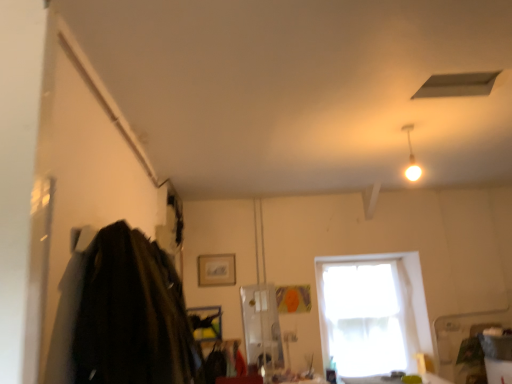
Question: Is white sheer curtain at center further to the viewer compared to dark wool coat at left?

Choices:
 (A) yes
 (B) no

Answer: (A)

Question: From the image's perspective, does white sheer curtain at center appear lower than dark wool coat at left?

Choices:
 (A) no
 (B) yes

Answer: (B)

Question: From the image's perspective, is white sheer curtain at center on dark wool coat at left?

Choices:
 (A) yes
 (B) no

Answer: (B)

Question: Is dark wool coat at left a part of white sheer curtain at center?

Choices:
 (A) yes
 (B) no

Answer: (B)

Question: Considering the relative positions of white sheer curtain at center and dark wool coat at left in the image provided, is white sheer curtain at center in front of dark wool coat at left?

Choices:
 (A) yes
 (B) no

Answer: (B)

Question: Is white sheer curtain at center in contact with dark wool coat at left?

Choices:
 (A) yes
 (B) no

Answer: (B)

Question: Does dark wool coat at left have a greater width compared to white sheer curtain at center?

Choices:
 (A) no
 (B) yes

Answer: (B)

Question: Is there a large distance between dark wool coat at left and white sheer curtain at center?

Choices:
 (A) no
 (B) yes

Answer: (B)

Question: Considering the relative sizes of dark wool coat at left and white sheer curtain at center in the image provided, is dark wool coat at left shorter than white sheer curtain at center?

Choices:
 (A) no
 (B) yes

Answer: (B)

Question: Can you confirm if dark wool coat at left is positioned to the right of white sheer curtain at center?

Choices:
 (A) no
 (B) yes

Answer: (A)

Question: From a real-world perspective, is dark wool coat at left located higher than white sheer curtain at center?

Choices:
 (A) no
 (B) yes

Answer: (B)

Question: Is white sheer curtain at center located within dark wool coat at left?

Choices:
 (A) no
 (B) yes

Answer: (A)

Question: Considering the relative positions of dark wool coat at left and white glossy light fixture at upper right in the image provided, is dark wool coat at left to the right of white glossy light fixture at upper right from the viewer's perspective?

Choices:
 (A) yes
 (B) no

Answer: (B)